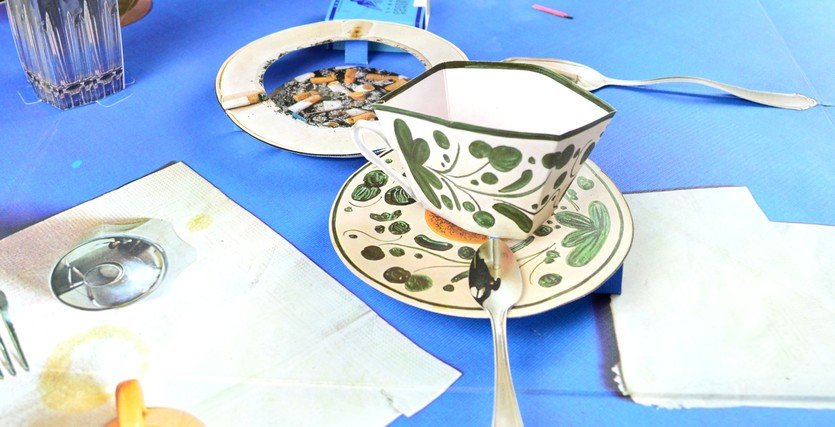
Where is `blue tablecloth`? The height and width of the screenshot is (427, 835). blue tablecloth is located at coordinates (685, 130).